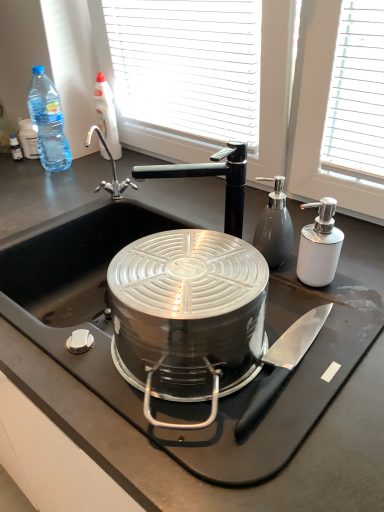
Identify the location of free area in between blue plastic bottle at upper left, acting as the third bottle starting from the right, and clear plastic bottle at upper left, which is the 3th bottle from front to back. The width and height of the screenshot is (384, 512). (88, 163).